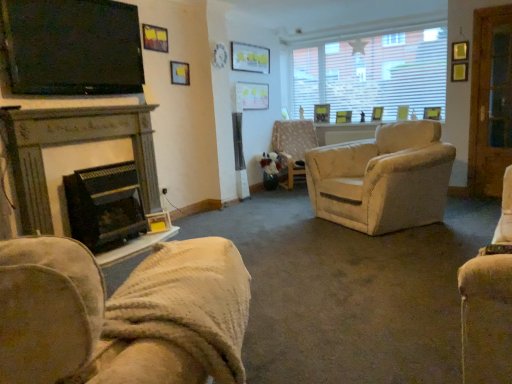
The width and height of the screenshot is (512, 384). What do you see at coordinates (373, 73) in the screenshot?
I see `white textured window at upper right` at bounding box center [373, 73].

Where is `matte black tv at upper left`? matte black tv at upper left is located at coordinates (72, 47).

This screenshot has height=384, width=512. Describe the element at coordinates (72, 47) in the screenshot. I see `matte black tv at upper left` at that location.

What do you see at coordinates (122, 315) in the screenshot? I see `velvet beige armchair at lower left, which is counted as the first chair, starting from the bottom` at bounding box center [122, 315].

At what (x,y) coordinates should I click in order to perform the action: click on wooden screen door at right. Please return your answer as a coordinate pair (x, y). This screenshot has height=384, width=512. Looking at the image, I should click on (490, 100).

Image resolution: width=512 pixels, height=384 pixels. What do you see at coordinates (71, 144) in the screenshot?
I see `dark gray stone fireplace at left, which appears as the second fireplace when ordered from the bottom` at bounding box center [71, 144].

Identify the location of dark gray stone fireplace at left, which appears as the second fireplace when ordered from the bottom. This screenshot has height=384, width=512. (71, 144).

In order to face black matte fireplace at left, which ranks as the first fireplace in bottom-to-top order, should I rotate leftwards or rightwards?

To align with it, rotate left about 18.222°.

What do you see at coordinates (250, 58) in the screenshot? I see `matte white picture frame at upper center` at bounding box center [250, 58].

In order to click on matte white picture frame at upper center in this screenshot , I will do `click(250, 58)`.

Identify the location of white textured window at upper right. (373, 73).

Consider the image. Between beige fabric chair at center, which ranks as the second chair in bottom-to-top order, and matte black tv at upper left, which one has more height?

beige fabric chair at center, which ranks as the second chair in bottom-to-top order, is taller.

Is beige fabric chair at center, which is counted as the 1th chair, starting from the top, wider or thinner than matte black tv at upper left?

Considering their sizes, beige fabric chair at center, which is counted as the 1th chair, starting from the top, looks broader than matte black tv at upper left.

Which object is more forward, beige fabric chair at center, which is counted as the 1th chair, starting from the top, or matte black tv at upper left?

matte black tv at upper left is more forward.

Between beige fabric chair at center, the 1th chair positioned from the right, and matte black tv at upper left, which one has smaller size?

Smaller between the two is matte black tv at upper left.

Does matte white picture frame at upper center turn towards wooden screen door at right?

No, matte white picture frame at upper center does not turn towards wooden screen door at right.

Locate an element on the screen. This screenshot has height=384, width=512. screen door below the matte white picture frame at upper center (from a real-world perspective) is located at coordinates (490, 100).

Is matte white picture frame at upper center further to camera compared to wooden screen door at right?

Yes, matte white picture frame at upper center is further from the camera.

Can you confirm if matte black tv at upper left is taller than matte white picture frame at upper center?

Indeed, matte black tv at upper left has a greater height compared to matte white picture frame at upper center.

Based on the photo, is matte black tv at upper left oriented away from matte white picture frame at upper center?

No, matte black tv at upper left is not facing away from matte white picture frame at upper center.

Which point is more distant from viewer, (141,48) or (263,61)?

The point (263,61) is more distant.

How far apart are dark gray stone fireplace at left, which appears as the second fireplace when ordered from the bottom, and black matte fireplace at left, which ranks as the first fireplace in bottom-to-top order?

dark gray stone fireplace at left, which appears as the second fireplace when ordered from the bottom, is 12.25 inches away from black matte fireplace at left, which ranks as the first fireplace in bottom-to-top order.

Which is nearer, (50,214) or (114,216)?

Point (50,214).

In the scene shown: Is dark gray stone fireplace at left, which appears as the second fireplace when ordered from the bottom, looking in the opposite direction of black matte fireplace at left, which ranks as the first fireplace in bottom-to-top order?

Yes, dark gray stone fireplace at left, which appears as the second fireplace when ordered from the bottom,'s orientation is away from black matte fireplace at left, which ranks as the first fireplace in bottom-to-top order.

Consider the image. From a real-world perspective, does dark gray stone fireplace at left, which appears as the second fireplace when ordered from the bottom, sit lower than black matte fireplace at left, which ranks as the first fireplace in bottom-to-top order?

No.

From the matte white picture frame at upper center, count 1st fireplaces forward and point to it. Please provide its 2D coordinates.

[(105, 205)]

From the picture: Who is smaller, matte white picture frame at upper center or black matte fireplace at left, which ranks as the first fireplace in bottom-to-top order?

matte white picture frame at upper center.

Does matte white picture frame at upper center have a lesser width compared to black matte fireplace at left, which ranks as the first fireplace in bottom-to-top order?

Yes.

Could you tell me if matte white picture frame at upper center is turned towards black matte fireplace at left, which ranks as the first fireplace in bottom-to-top order?

No, matte white picture frame at upper center is not oriented towards black matte fireplace at left, which ranks as the first fireplace in bottom-to-top order.

Is dark gray stone fireplace at left, which appears as the second fireplace when ordered from the bottom, placed right next to matte white picture frame at upper center?

dark gray stone fireplace at left, which appears as the second fireplace when ordered from the bottom, is not next to matte white picture frame at upper center, and they're not touching.

Is point (34, 132) farther from camera compared to point (251, 57)?

No, (34, 132) is closer to viewer.

Consider the image. Which of these two, dark gray stone fireplace at left, which appears as the second fireplace when ordered from the bottom, or matte white picture frame at upper center, stands taller?

With more height is dark gray stone fireplace at left, which appears as the second fireplace when ordered from the bottom.

This screenshot has width=512, height=384. In the image, there is a dark gray stone fireplace at left, which appears as the second fireplace when ordered from the bottom. What are the coordinates of `picture frame above it (from the image's perspective)` in the screenshot? It's located at (250, 58).

From the image's perspective, is white textured window at upper right above or below matte white picture frame at upper center?

Clearly, from the image's perspective, white textured window at upper right is below matte white picture frame at upper center.

Is matte white picture frame at upper center completely or partially inside white textured window at upper right?

Definitely not — matte white picture frame at upper center is not inside white textured window at upper right.

From a real-world perspective, is white textured window at upper right positioned above or below matte white picture frame at upper center?

Clearly, from a real-world perspective, white textured window at upper right is below matte white picture frame at upper center.

At what (x,y) coordinates should I click in order to perform the action: click on window directly beneath the matte white picture frame at upper center (from a real-world perspective). Please return your answer as a coordinate pair (x, y). Image resolution: width=512 pixels, height=384 pixels. Looking at the image, I should click on (373, 73).

At what (x,y) coordinates should I click in order to perform the action: click on chair lying behind the matte black tv at upper left. Please return your answer as a coordinate pair (x, y). Looking at the image, I should click on (293, 146).

You are a GUI agent. You are given a task and a screenshot of the screen. Output one action in this format:
    pyautogui.click(x=<x>, y=<y>)
    Task: Click on the screen door directly beneath the matte white picture frame at upper center (from a real-world perspective)
    
    Given the screenshot: What is the action you would take?
    pyautogui.click(x=490, y=100)

From the image, which object appears to be nearer to beige fabric chair at center, which is counted as the 1th chair, starting from the top, matte black tv at upper left or wooden screen door at right?

Among the two, wooden screen door at right is located nearer to beige fabric chair at center, which is counted as the 1th chair, starting from the top.

When comparing their distances from velvet beige armchair at lower left, the 2th chair positioned from the top, does black matte fireplace at left, which ranks as the first fireplace in bottom-to-top order, or wooden screen door at right seem closer?

black matte fireplace at left, which ranks as the first fireplace in bottom-to-top order, lies closer to velvet beige armchair at lower left, the 2th chair positioned from the top, than the other object.

Based on their spatial positions, is matte black tv at upper left or matte white picture frame at upper center further from beige fabric chair at center, the second chair in the front-to-back sequence?

matte black tv at upper left is positioned further to the anchor beige fabric chair at center, the second chair in the front-to-back sequence.

Considering their positions, is matte white picture frame at upper center positioned closer to wooden screen door at right than beige fabric chair at center, the 1th chair in the back-to-front sequence?

beige fabric chair at center, the 1th chair in the back-to-front sequence, is closer to wooden screen door at right.

Considering their positions, is velvet beige armchair at lower left, which is the 1th chair from front to back, positioned further to dark gray stone fireplace at left, marked as the first fireplace in a top-to-bottom arrangement, than wooden screen door at right?

The object further to dark gray stone fireplace at left, marked as the first fireplace in a top-to-bottom arrangement, is wooden screen door at right.

When comparing their distances from white textured window at upper right, does matte white picture frame at upper center or wooden screen door at right seem closer?

matte white picture frame at upper center.

From the image, which object appears to be nearer to beige fabric chair at center, acting as the 2th chair starting from the left, matte black tv at upper left or black matte fireplace at left, which ranks as the first fireplace in bottom-to-top order?

black matte fireplace at left, which ranks as the first fireplace in bottom-to-top order, is closer to beige fabric chair at center, acting as the 2th chair starting from the left.

Based on the photo, looking at the image, which one is located closer to velvet beige armchair at lower left, the second chair in the right-to-left sequence, white textured window at upper right or wooden screen door at right?

wooden screen door at right is positioned closer to the anchor velvet beige armchair at lower left, the second chair in the right-to-left sequence.

Where is `television positioned between velvet beige armchair at lower left, the second chair from the back, and beige fabric chair at center, the 1th chair in the back-to-front sequence, from near to far`? This screenshot has height=384, width=512. television positioned between velvet beige armchair at lower left, the second chair from the back, and beige fabric chair at center, the 1th chair in the back-to-front sequence, from near to far is located at coordinates (72, 47).

Locate an element on the screen. The height and width of the screenshot is (384, 512). picture frame located between dark gray stone fireplace at left, marked as the first fireplace in a top-to-bottom arrangement, and beige fabric chair at center, which is counted as the 1th chair, starting from the top, in the depth direction is located at coordinates pyautogui.click(x=250, y=58).

At what (x,y) coordinates should I click in order to perform the action: click on television located between velvet beige armchair at lower left, the 2th chair positioned from the top, and matte white picture frame at upper center in the depth direction. Please return your answer as a coordinate pair (x, y). Looking at the image, I should click on (72, 47).

I want to click on fireplace between matte black tv at upper left and black matte fireplace at left, which is counted as the 2th fireplace, starting from the top, in the vertical direction, so click(x=71, y=144).